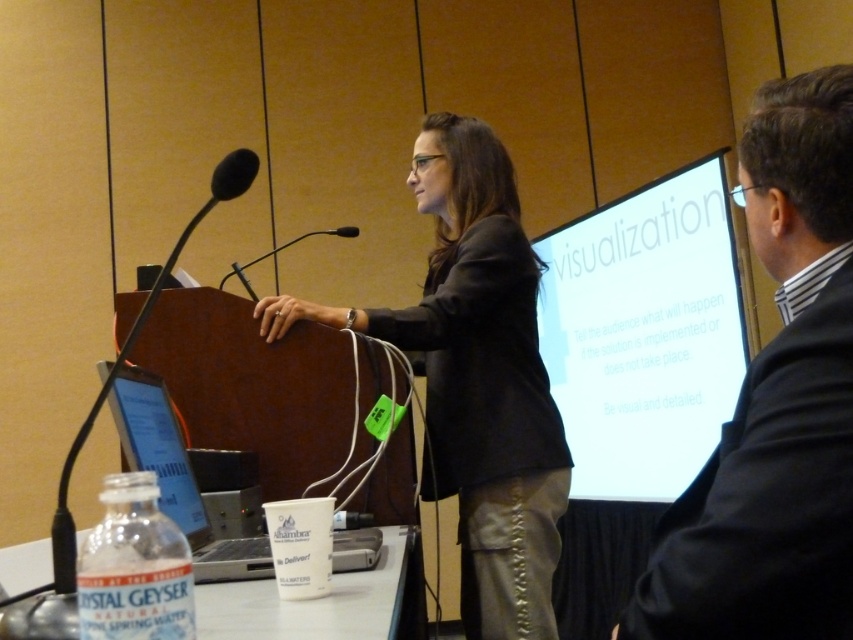
Does dark gray blazer at center lie behind black plastic microphone at center?

No, dark gray blazer at center is closer to the viewer.

Is dark gray blazer at center thinner than black plastic microphone at center?

No.

What are the coordinates of `dark gray blazer at center` in the screenshot? It's located at (476, 378).

Is dark gray blazer at center below clear plastic bottle at lower left?

Incorrect, dark gray blazer at center is not positioned below clear plastic bottle at lower left.

Which of these two, dark gray blazer at center or clear plastic bottle at lower left, stands taller?

dark gray blazer at center

What do you see at coordinates (476, 378) in the screenshot? I see `dark gray blazer at center` at bounding box center [476, 378].

I want to click on dark gray blazer at center, so click(x=476, y=378).

Is clear plastic bottle at lower left further to camera compared to black matte microphone at left?

No, clear plastic bottle at lower left is in front of black matte microphone at left.

Can you confirm if clear plastic bottle at lower left is wider than black matte microphone at left?

In fact, clear plastic bottle at lower left might be narrower than black matte microphone at left.

In order to click on clear plastic bottle at lower left in this screenshot , I will do `click(323, 602)`.